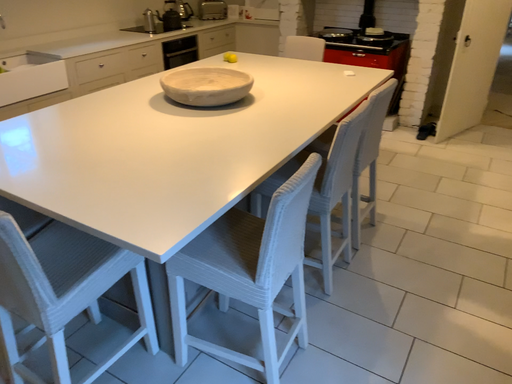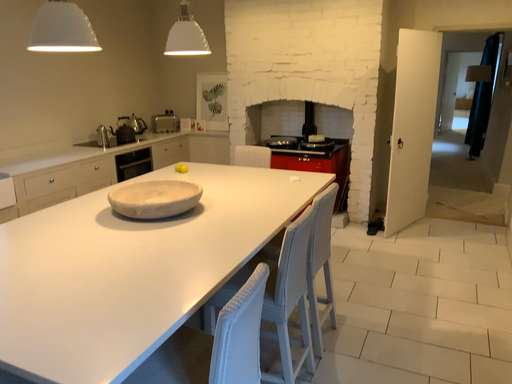
Question: Which way did the camera rotate in the video?

Choices:
 (A) rotated downward
 (B) rotated upward

Answer: (B)